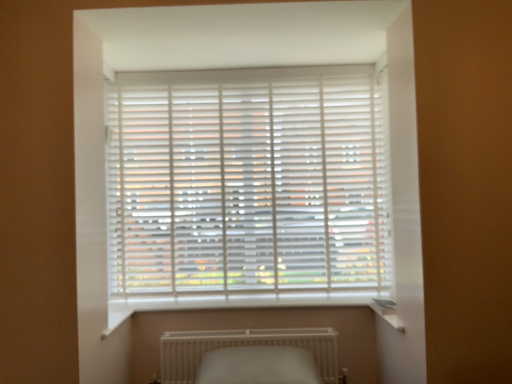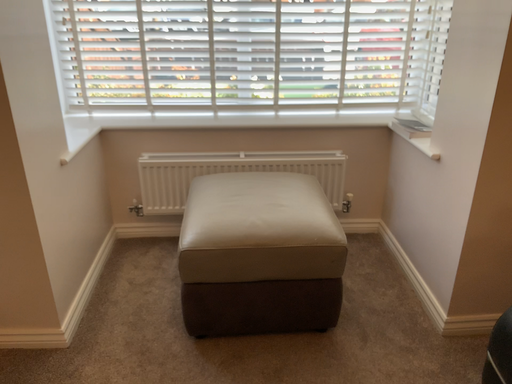
Question: How did the camera likely rotate when shooting the video?

Choices:
 (A) rotated downward
 (B) rotated upward

Answer: (A)